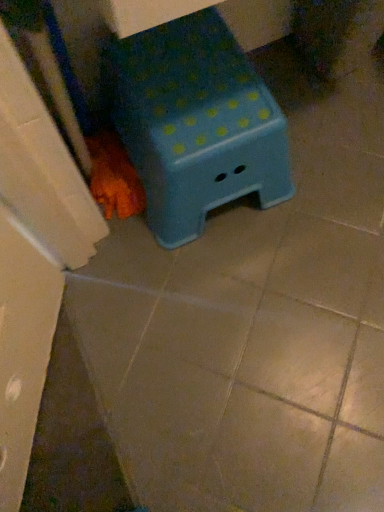
At what (x,y) coordinates should I click in order to perform the action: click on free space in front of blue plastic stool at center. Please return your answer as a coordinate pair (x, y). Image resolution: width=384 pixels, height=512 pixels. Looking at the image, I should click on (222, 294).